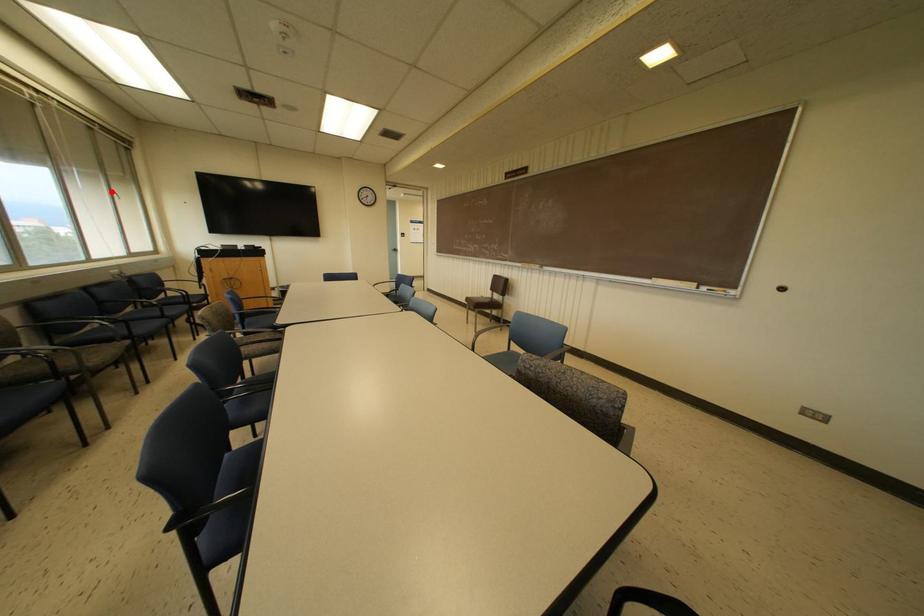
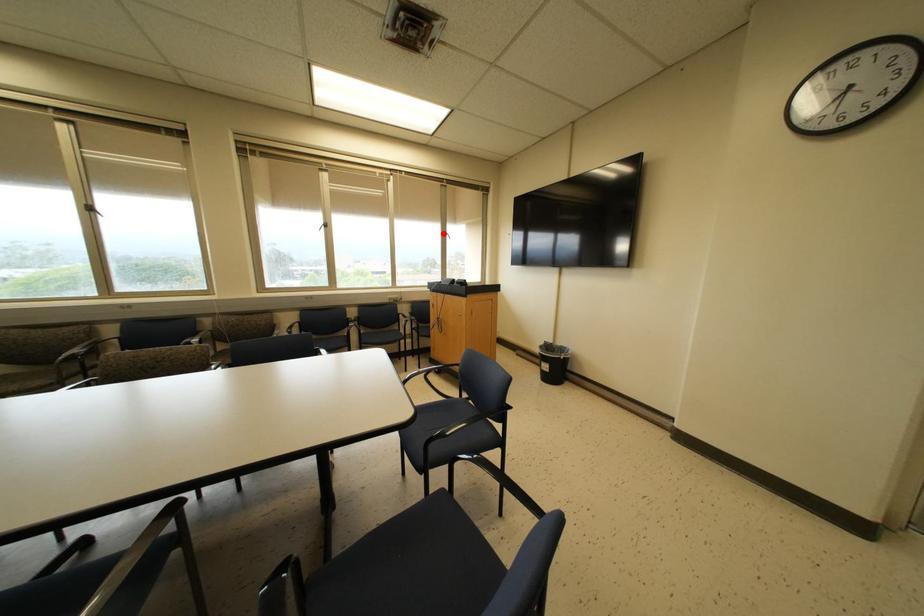
I am providing you with two images of the same scene from different viewpoints. A red point is marked on the first image and another point is marked on the second image. Is the red point in image1 aligned with the point shown in image2?

Yes